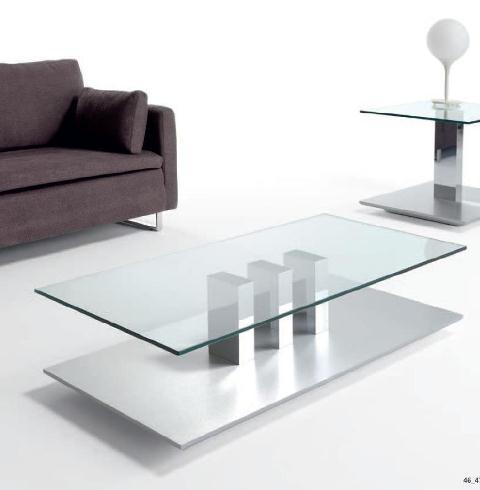
Image resolution: width=480 pixels, height=490 pixels. I want to click on couch leg, so click(158, 219).